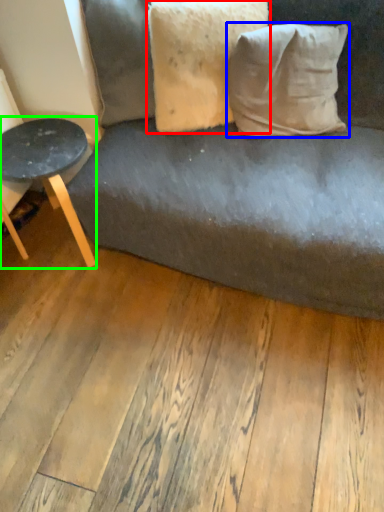
Question: Which object is the closest to the pillow (highlighted by a red box)? Choose among these: pillow (highlighted by a blue box) or table (highlighted by a green box).

Choices:
 (A) pillow
 (B) table

Answer: (A)